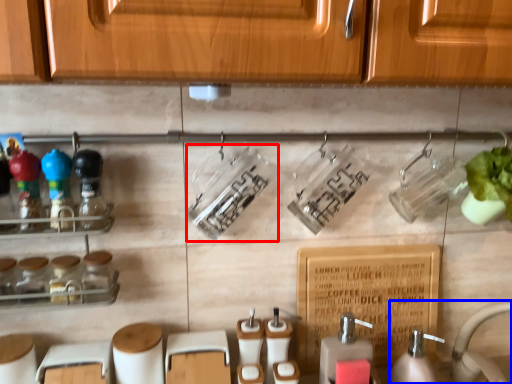
Question: Which point is closer to the camera, bottle (highlighted by a red box) or sink (highlighted by a blue box)?

Choices:
 (A) bottle
 (B) sink

Answer: (B)